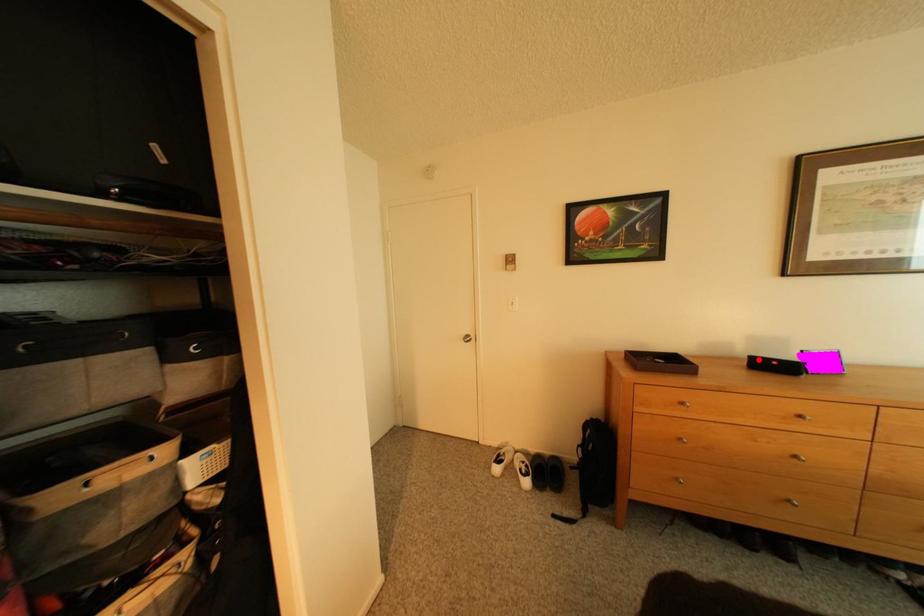
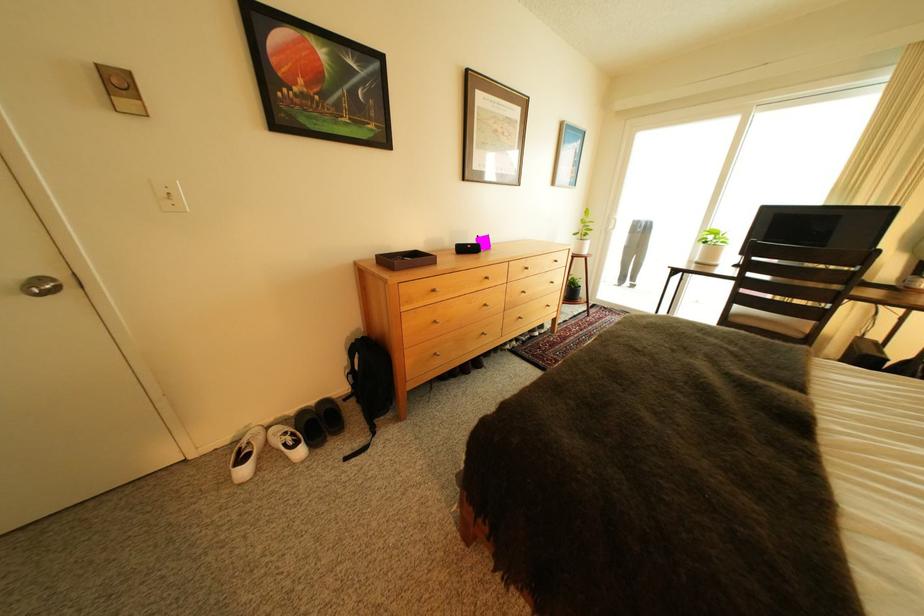
Question: I am providing you with two images of the same scene from different viewpoints. Image1 has a red point marked. In image2, the corresponding 3D location appears at what relative position? Reply with the corresponding letter.

Choices:
 (A) Closer
 (B) Farther

Answer: (A)